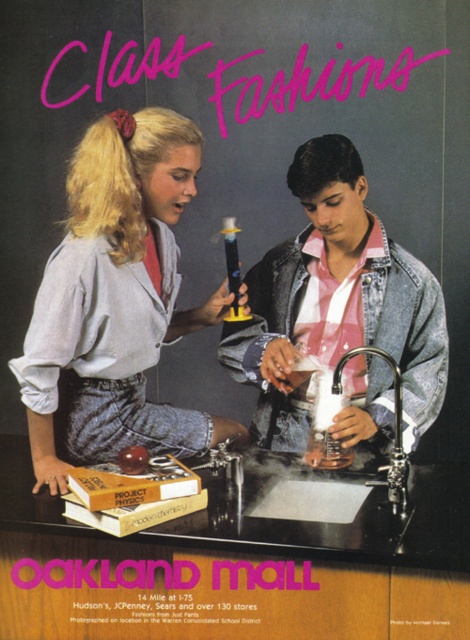
Can you confirm if matte blue shirt at center is bigger than denim jacket at center?

Correct, matte blue shirt at center is larger in size than denim jacket at center.

Is matte blue shirt at center shorter than denim jacket at center?

In fact, matte blue shirt at center may be taller than denim jacket at center.

Between point (55, 364) and point (292, 410), which one is positioned in front?

Positioned in front is point (55, 364).

Where is `matte blue shirt at center`? matte blue shirt at center is located at coordinates (117, 298).

Does matte blue shirt at center appear on the left side of polished chrome faucet at lower center?

Correct, you'll find matte blue shirt at center to the left of polished chrome faucet at lower center.

Between matte blue shirt at center and polished chrome faucet at lower center, which one is positioned lower?

Positioned lower is polished chrome faucet at lower center.

Is point (125, 113) positioned after point (405, 500)?

That is True.

Find the location of a particular element. The width and height of the screenshot is (470, 640). matte blue shirt at center is located at coordinates (117, 298).

Is denim jacket at center closer to the viewer compared to polished chrome faucet at lower center?

No, it is not.

The height and width of the screenshot is (640, 470). Describe the element at coordinates (336, 301) in the screenshot. I see `denim jacket at center` at that location.

Which is in front, point (368, 296) or point (405, 460)?

Point (405, 460)

You are a GUI agent. You are given a task and a screenshot of the screen. Output one action in this format:
    pyautogui.click(x=<x>, y=<y>)
    Task: Click on the denim jacket at center
    The image size is (470, 640).
    Given the screenshot: What is the action you would take?
    pyautogui.click(x=336, y=301)